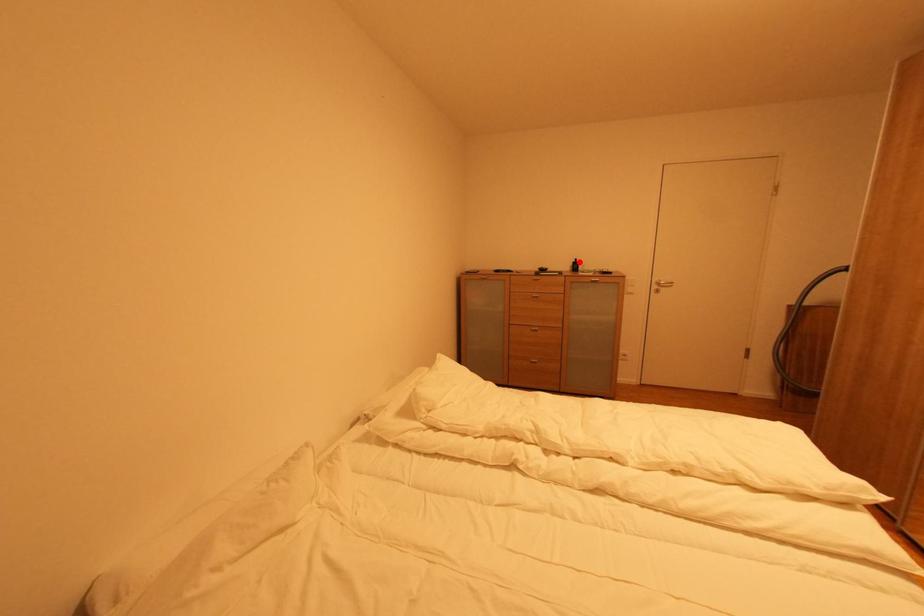
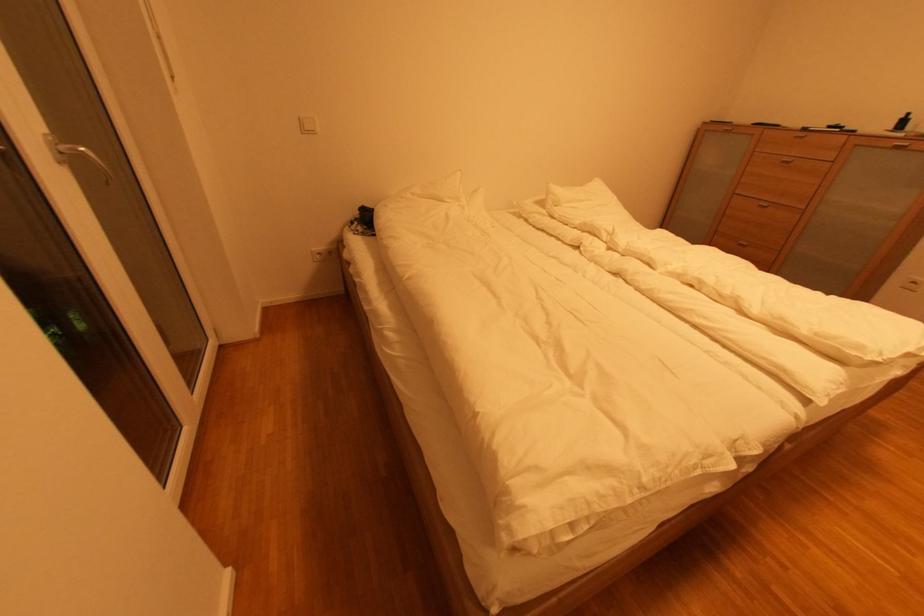
Locate, in the second image, the point that corresponds to the highlighted location in the first image.

(908, 118)